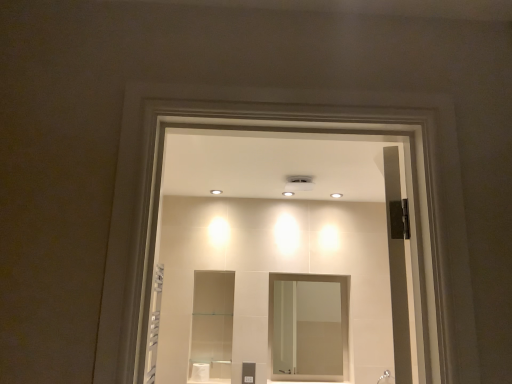
The height and width of the screenshot is (384, 512). Identify the location of white glossy shower head at lower right. (386, 378).

Describe the element at coordinates (386, 378) in the screenshot. This screenshot has width=512, height=384. I see `white glossy shower head at lower right` at that location.

The width and height of the screenshot is (512, 384). What do you see at coordinates (307, 328) in the screenshot?
I see `clear glass mirror at center` at bounding box center [307, 328].

You are a GUI agent. You are given a task and a screenshot of the screen. Output one action in this format:
    pyautogui.click(x=<x>, y=<y>)
    Task: Click on the clear glass mirror at center
    
    Given the screenshot: What is the action you would take?
    pyautogui.click(x=307, y=328)

This screenshot has width=512, height=384. I want to click on white glossy shower head at lower right, so click(386, 378).

Considering the positions of objects clear glass mirror at center and white glossy shower head at lower right in the image provided, who is more to the right, clear glass mirror at center or white glossy shower head at lower right?

white glossy shower head at lower right is more to the right.

Is clear glass mirror at center positioned behind white glossy shower head at lower right?

Yes, it is behind white glossy shower head at lower right.

Considering the positions of points (306, 284) and (384, 374), is point (306, 284) farther from camera compared to point (384, 374)?

Yes, it is.

From the image's perspective, is clear glass mirror at center located above white glossy shower head at lower right?

Yes, from the image's perspective, clear glass mirror at center is above white glossy shower head at lower right.

From a real-world perspective, is clear glass mirror at center above or below white glossy shower head at lower right?

Clearly, from a real-world perspective, clear glass mirror at center is above white glossy shower head at lower right.

In terms of width, does clear glass mirror at center look wider or thinner when compared to white glossy shower head at lower right?

Considering their sizes, clear glass mirror at center looks slimmer than white glossy shower head at lower right.

Can you confirm if clear glass mirror at center is taller than white glossy shower head at lower right?

Yes.

In terms of size, does clear glass mirror at center appear bigger or smaller than white glossy shower head at lower right?

In the image, clear glass mirror at center appears to be larger than white glossy shower head at lower right.

Is clear glass mirror at center not within white glossy shower head at lower right?

clear glass mirror at center lies outside white glossy shower head at lower right's area.

Are clear glass mirror at center and white glossy shower head at lower right making contact?

clear glass mirror at center and white glossy shower head at lower right are not in contact.

Could you tell me if clear glass mirror at center is facing white glossy shower head at lower right?

No, clear glass mirror at center is not aimed at white glossy shower head at lower right.

Locate an element on the screen. mirror positioned vertically above the white glossy shower head at lower right (from a real-world perspective) is located at coordinates (307, 328).

Considering the relative positions of white glossy shower head at lower right and clear glass mirror at center in the image provided, is white glossy shower head at lower right to the left or to the right of clear glass mirror at center?

From the image, it's evident that white glossy shower head at lower right is to the right of clear glass mirror at center.

Is the depth of white glossy shower head at lower right less than that of clear glass mirror at center?

Yes, it is in front of clear glass mirror at center.

Between point (390, 376) and point (313, 323), which one is positioned in front?

The point (390, 376) is closer.

From the image's perspective, between white glossy shower head at lower right and clear glass mirror at center, who is located below?

From the image's view, white glossy shower head at lower right is below.

From a real-world perspective, which object stands above the other?

clear glass mirror at center, from a real-world perspective.

From the picture: In terms of width, does white glossy shower head at lower right look wider or thinner when compared to clear glass mirror at center?

In the image, white glossy shower head at lower right appears to be wider than clear glass mirror at center.

Considering the sizes of objects white glossy shower head at lower right and clear glass mirror at center in the image provided, who is taller, white glossy shower head at lower right or clear glass mirror at center?

With more height is clear glass mirror at center.

Between white glossy shower head at lower right and clear glass mirror at center, which one has smaller size?

With smaller size is white glossy shower head at lower right.

Is white glossy shower head at lower right completely or partially outside of clear glass mirror at center?

white glossy shower head at lower right lies outside clear glass mirror at center's area.

Is white glossy shower head at lower right positioned far away from clear glass mirror at center?

Indeed, white glossy shower head at lower right is not near clear glass mirror at center.

Could you tell me if white glossy shower head at lower right is turned towards clear glass mirror at center?

No, white glossy shower head at lower right is not aimed at clear glass mirror at center.

The height and width of the screenshot is (384, 512). I want to click on mirror behind the white glossy shower head at lower right, so click(307, 328).

At what (x,y) coordinates should I click in order to perform the action: click on shower below the clear glass mirror at center (from the image's perspective). Please return your answer as a coordinate pair (x, y). Looking at the image, I should click on (386, 378).

Locate an element on the screen. This screenshot has width=512, height=384. mirror lying above the white glossy shower head at lower right (from the image's perspective) is located at coordinates (307, 328).